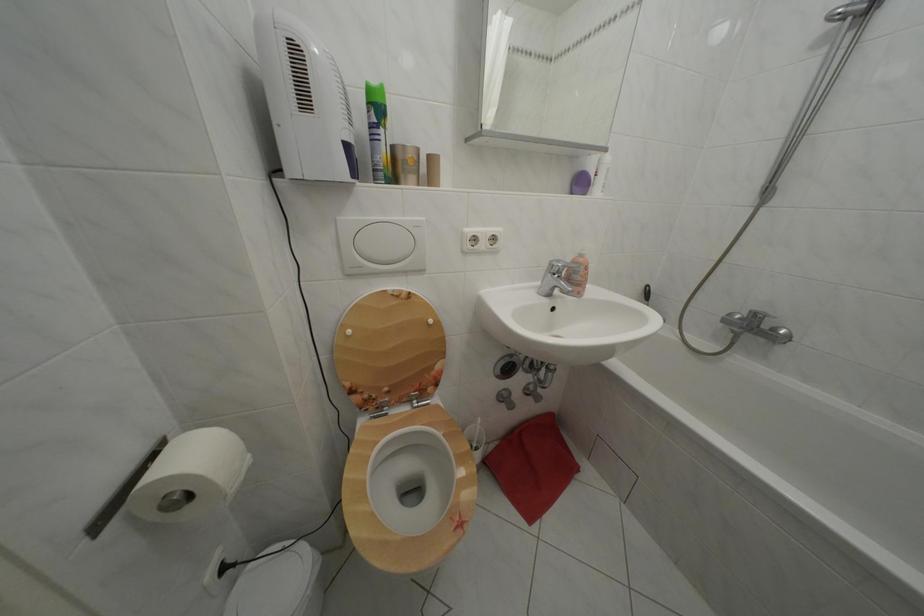
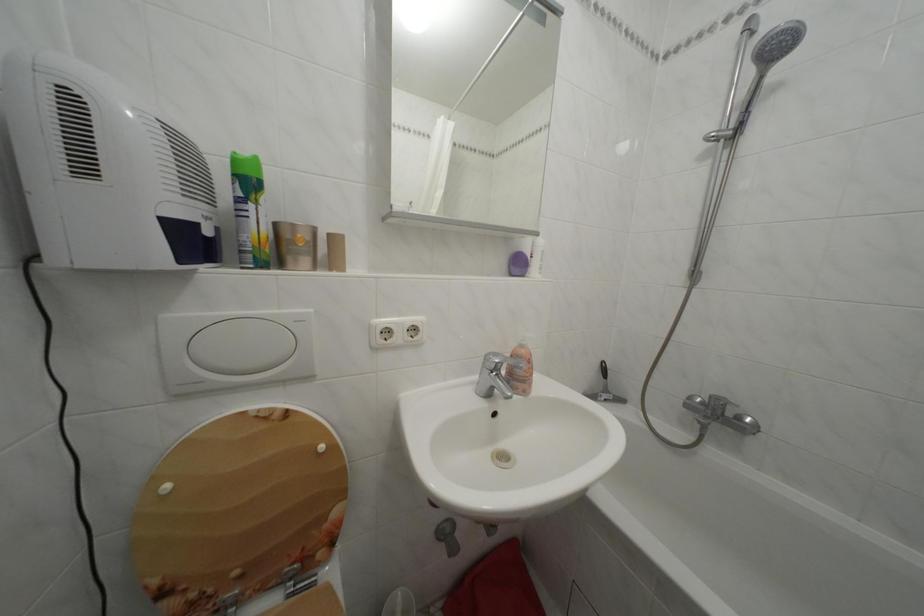
Question: How did the camera likely rotate?

Choices:
 (A) Left
 (B) Right
 (C) Up
 (D) Down

Answer: (C)